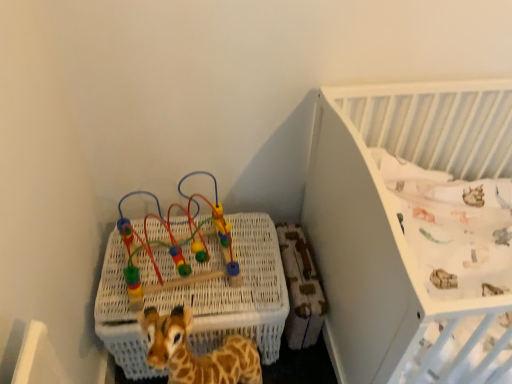
Question: Is multicolored plastic bead maze at upper left bigger or smaller than white wicker basket at lower left?

Choices:
 (A) small
 (B) big

Answer: (A)

Question: In the image, is multicolored plastic bead maze at upper left positioned in front of or behind white wicker basket at lower left?

Choices:
 (A) behind
 (B) front

Answer: (B)

Question: Which object is the closest to the white wicker basket at lower left?

Choices:
 (A) multicolored plastic bead maze at upper left
 (B) white textured crib at upper right

Answer: (A)

Question: Which object is the farthest from the white wicker basket at lower left?

Choices:
 (A) multicolored plastic bead maze at upper left
 (B) white textured crib at upper right

Answer: (B)